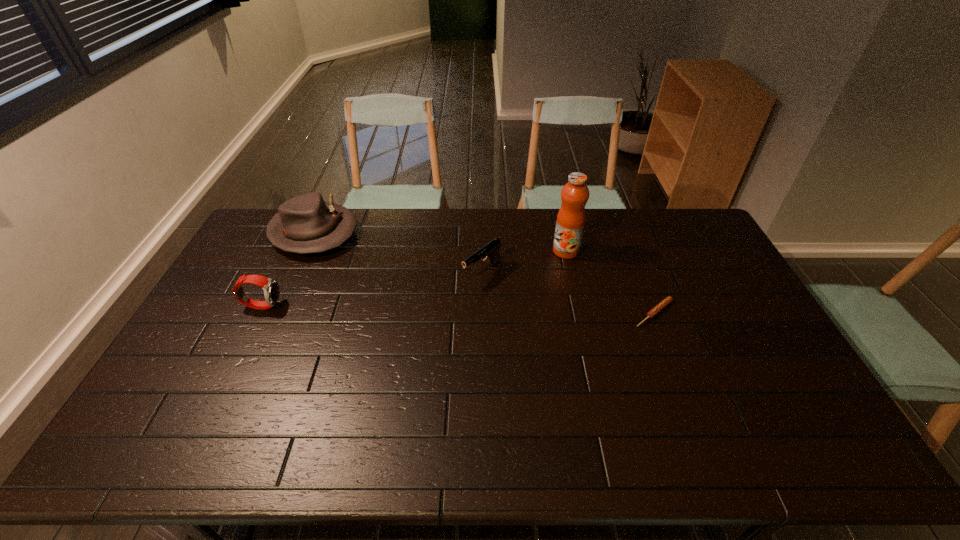
Find the location of a particular element. Image resolution: width=960 pixels, height=540 pixels. vacant region located 0.210m on the front label of the fourth object from left to right is located at coordinates (512, 281).

Where is `free spot located 0.200m on the front label of the fourth object from left to right`? The image size is (960, 540). free spot located 0.200m on the front label of the fourth object from left to right is located at coordinates (514, 280).

The image size is (960, 540). I want to click on vacant position located 0.220m on the decorative side of the hat, so click(377, 282).

Find the location of `free space located on the decorative side of the hat`. free space located on the decorative side of the hat is located at coordinates (363, 271).

Locate an element on the screen. The height and width of the screenshot is (540, 960). vacant space situated 0.220m on the decorative side of the hat is located at coordinates (377, 282).

This screenshot has width=960, height=540. I want to click on vacant area located 0.390m at the muzzle of the pistol, so click(376, 356).

What are the coordinates of `free spot located at the muzzle of the pistol` in the screenshot? It's located at 432,313.

Where is `free space located at the muzzle of the pistol`? This screenshot has height=540, width=960. free space located at the muzzle of the pistol is located at coordinates (411, 330).

The image size is (960, 540). In order to click on fruit juice that is positioned at the far edge in this screenshot , I will do click(x=571, y=217).

What are the coordinates of `hat present at the far edge` in the screenshot? It's located at (305, 224).